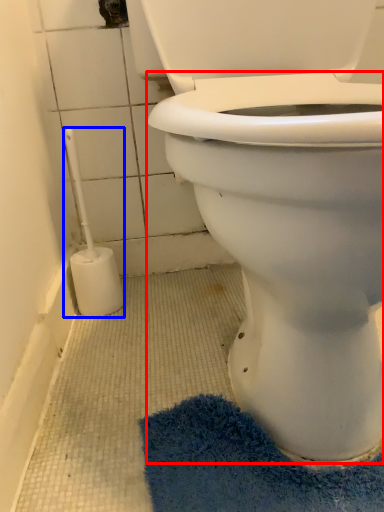
Question: Which object is further to the camera taking this photo, bidet (highlighted by a red box) or brush (highlighted by a blue box)?

Choices:
 (A) bidet
 (B) brush

Answer: (B)